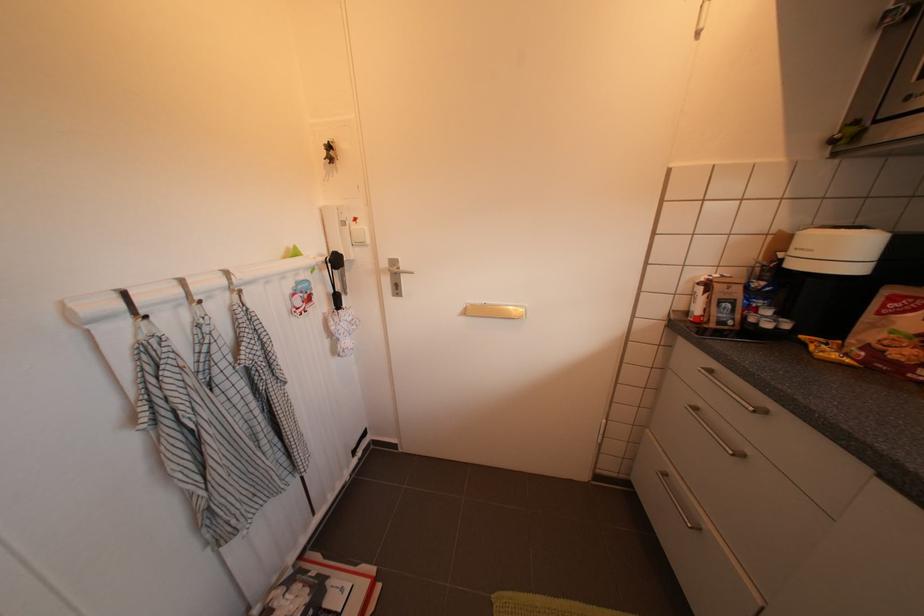
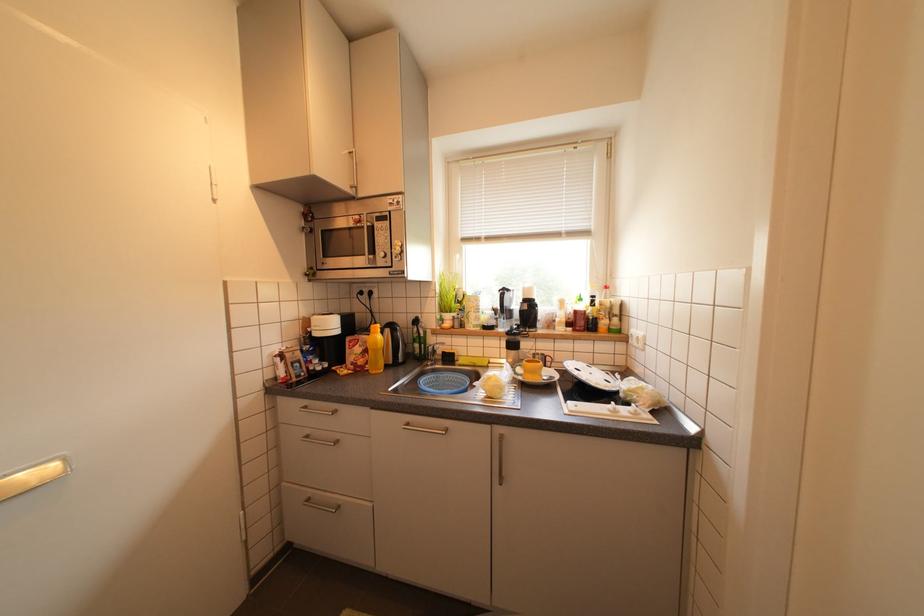
Question: How did the camera likely rotate?

Choices:
 (A) Left
 (B) Right
 (C) Up
 (D) Down

Answer: (B)